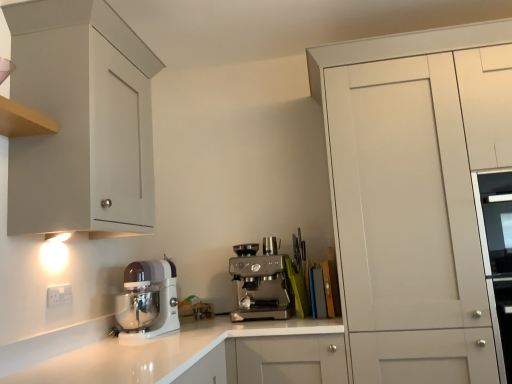
What do you see at coordinates (147, 300) in the screenshot? The height and width of the screenshot is (384, 512). I see `white glossy stand mixer at lower left, placed as the 2th kitchen appliance when sorted from right to left` at bounding box center [147, 300].

At what (x,y) coordinates should I click in order to perform the action: click on satin silver espresso machine at center, which ranks as the second kitchen appliance in left-to-right order. Please return your answer as a coordinate pair (x, y). Looking at the image, I should click on (261, 282).

Considering the sizes of white glossy countertop at center and white matte cabinet at right, the first cabinetry in the right-to-left sequence, in the image, is white glossy countertop at center wider or thinner than white matte cabinet at right, the first cabinetry in the right-to-left sequence,?

Considering their sizes, white glossy countertop at center looks slimmer than white matte cabinet at right, the first cabinetry in the right-to-left sequence.

From the image's perspective, which object appears higher, white glossy countertop at center or white matte cabinet at right, the second cabinetry from the left?

white matte cabinet at right, the second cabinetry from the left.

You are a GUI agent. You are given a task and a screenshot of the screen. Output one action in this format:
    pyautogui.click(x=<x>, y=<y>)
    Task: Click on the 1st cabinetry directly above the white glossy countertop at center (from a real-world perspective)
    
    Given the screenshot: What is the action you would take?
    pyautogui.click(x=415, y=195)

Looking at this image, considering the sizes of objects white glossy countertop at center and white matte cabinet at right, the second cabinetry from the left, in the image provided, who is smaller, white glossy countertop at center or white matte cabinet at right, the second cabinetry from the left,?

white glossy countertop at center is smaller.

Which of these two, white plastic electric outlet at lower left or white glossy countertop at center, stands taller?

white glossy countertop at center is taller.

Is white plastic electric outlet at lower left wider than white glossy countertop at center?

Incorrect, the width of white plastic electric outlet at lower left does not surpass that of white glossy countertop at center.

From a real-world perspective, is white plastic electric outlet at lower left positioned under white glossy countertop at center based on gravity?

Actually, white plastic electric outlet at lower left is physically above white glossy countertop at center in the real world.

Which point is more distant from viewer, (47, 291) or (115, 370)?

Point (47, 291)

Which of these two, white plastic electric outlet at lower left or satin silver espresso machine at center, marked as the 1th kitchen appliance in a right-to-left arrangement, is bigger?

satin silver espresso machine at center, marked as the 1th kitchen appliance in a right-to-left arrangement.

From a real-world perspective, who is located higher, white plastic electric outlet at lower left or satin silver espresso machine at center, which ranks as the second kitchen appliance in left-to-right order?

white plastic electric outlet at lower left, from a real-world perspective.

What's the angular difference between white plastic electric outlet at lower left and satin silver espresso machine at center, marked as the 1th kitchen appliance in a right-to-left arrangement,'s facing directions?

white plastic electric outlet at lower left and satin silver espresso machine at center, marked as the 1th kitchen appliance in a right-to-left arrangement, are facing 88.3 degrees away from each other.

Which object is more forward, matte gray cabinet at upper left, the 2th cabinetry when ordered from right to left, or satin silver espresso machine at center, marked as the 1th kitchen appliance in a right-to-left arrangement?

matte gray cabinet at upper left, the 2th cabinetry when ordered from right to left, is in front.

Are matte gray cabinet at upper left, the first cabinetry viewed from the left, and satin silver espresso machine at center, marked as the 1th kitchen appliance in a right-to-left arrangement, far apart?

No, there isn't a large distance between matte gray cabinet at upper left, the first cabinetry viewed from the left, and satin silver espresso machine at center, marked as the 1th kitchen appliance in a right-to-left arrangement.

How different are the orientations of matte gray cabinet at upper left, the 2th cabinetry when ordered from right to left, and satin silver espresso machine at center, marked as the 1th kitchen appliance in a right-to-left arrangement, in degrees?

They differ by 89.4 degrees in their facing directions.

Between matte gray cabinet at upper left, the 2th cabinetry when ordered from right to left, and satin silver espresso machine at center, which ranks as the second kitchen appliance in left-to-right order, which one has smaller size?

Smaller between the two is satin silver espresso machine at center, which ranks as the second kitchen appliance in left-to-right order.

Would you say white glossy stand mixer at lower left, which is counted as the first kitchen appliance, starting from the left, is part of white plastic electric outlet at lower left's contents?

No, white plastic electric outlet at lower left does not contain white glossy stand mixer at lower left, which is counted as the first kitchen appliance, starting from the left.

Is white plastic electric outlet at lower left further to the viewer compared to white glossy stand mixer at lower left, placed as the 2th kitchen appliance when sorted from right to left?

That is False.

In the scene shown: From a real-world perspective, is white plastic electric outlet at lower left under white glossy stand mixer at lower left, placed as the 2th kitchen appliance when sorted from right to left?

No.

This screenshot has width=512, height=384. I want to click on kitchen appliance that is the 1st one when counting backward from the white plastic electric outlet at lower left, so click(x=147, y=300).

Does white matte cabinet at right, the first cabinetry in the right-to-left sequence, have a larger size compared to satin silver espresso machine at center, marked as the 1th kitchen appliance in a right-to-left arrangement?

Yes, white matte cabinet at right, the first cabinetry in the right-to-left sequence, is bigger than satin silver espresso machine at center, marked as the 1th kitchen appliance in a right-to-left arrangement.

Considering the sizes of objects white matte cabinet at right, the first cabinetry in the right-to-left sequence, and satin silver espresso machine at center, which ranks as the second kitchen appliance in left-to-right order, in the image provided, who is wider, white matte cabinet at right, the first cabinetry in the right-to-left sequence, or satin silver espresso machine at center, which ranks as the second kitchen appliance in left-to-right order,?

white matte cabinet at right, the first cabinetry in the right-to-left sequence.

How many degrees apart are the facing directions of white matte cabinet at right, the first cabinetry in the right-to-left sequence, and satin silver espresso machine at center, which ranks as the second kitchen appliance in left-to-right order?

white matte cabinet at right, the first cabinetry in the right-to-left sequence, and satin silver espresso machine at center, which ranks as the second kitchen appliance in left-to-right order, are facing 0.39 degrees away from each other.

Does point (365, 91) appear closer or farther from the camera than point (256, 280)?

Point (365, 91).

At what (x,y) coordinates should I click in order to perform the action: click on cabinetry to the left of white matte cabinet at right, the first cabinetry in the right-to-left sequence. Please return your answer as a coordinate pair (x, y). Image resolution: width=512 pixels, height=384 pixels. Looking at the image, I should click on (81, 121).

Is white matte cabinet at right, the first cabinetry in the right-to-left sequence, far from matte gray cabinet at upper left, the first cabinetry viewed from the left?

Yes, white matte cabinet at right, the first cabinetry in the right-to-left sequence, is far from matte gray cabinet at upper left, the first cabinetry viewed from the left.

From the image's perspective, is white matte cabinet at right, the first cabinetry in the right-to-left sequence, beneath matte gray cabinet at upper left, the 2th cabinetry when ordered from right to left?

Indeed, from the image's perspective, white matte cabinet at right, the first cabinetry in the right-to-left sequence, is shown beneath matte gray cabinet at upper left, the 2th cabinetry when ordered from right to left.

Considering the relative sizes of white matte cabinet at right, the first cabinetry in the right-to-left sequence, and matte gray cabinet at upper left, the first cabinetry viewed from the left, in the image provided, is white matte cabinet at right, the first cabinetry in the right-to-left sequence, taller than matte gray cabinet at upper left, the first cabinetry viewed from the left,?

Yes, white matte cabinet at right, the first cabinetry in the right-to-left sequence, is taller than matte gray cabinet at upper left, the first cabinetry viewed from the left.

The height and width of the screenshot is (384, 512). Identify the location of cabinetry located on the right of white glossy countertop at center. click(415, 195).

Where is `electric outlet located in front of the white glossy countertop at center`? The height and width of the screenshot is (384, 512). electric outlet located in front of the white glossy countertop at center is located at coordinates (59, 295).

Looking at the image, which one is located further to satin silver espresso machine at center, which ranks as the second kitchen appliance in left-to-right order, white glossy countertop at center or white matte cabinet at right, the first cabinetry in the right-to-left sequence?

white matte cabinet at right, the first cabinetry in the right-to-left sequence, is positioned further to the anchor satin silver espresso machine at center, which ranks as the second kitchen appliance in left-to-right order.

Based on their spatial positions, is white glossy countertop at center or white matte cabinet at right, the first cabinetry in the right-to-left sequence, further from matte gray cabinet at upper left, the 2th cabinetry when ordered from right to left?

Among the two, white matte cabinet at right, the first cabinetry in the right-to-left sequence, is located further to matte gray cabinet at upper left, the 2th cabinetry when ordered from right to left.

Which object lies nearer to the anchor point white glossy stand mixer at lower left, which is counted as the first kitchen appliance, starting from the left, white plastic electric outlet at lower left or matte gray cabinet at upper left, the 2th cabinetry when ordered from right to left?

Among the two, white plastic electric outlet at lower left is located nearer to white glossy stand mixer at lower left, which is counted as the first kitchen appliance, starting from the left.

Based on their spatial positions, is matte gray cabinet at upper left, the 2th cabinetry when ordered from right to left, or white matte cabinet at right, the second cabinetry from the left, closer to white glossy stand mixer at lower left, which is counted as the first kitchen appliance, starting from the left?

matte gray cabinet at upper left, the 2th cabinetry when ordered from right to left, is positioned closer to the anchor white glossy stand mixer at lower left, which is counted as the first kitchen appliance, starting from the left.

Based on their spatial positions, is matte gray cabinet at upper left, the 2th cabinetry when ordered from right to left, or white glossy countertop at center further from white plastic electric outlet at lower left?

matte gray cabinet at upper left, the 2th cabinetry when ordered from right to left, lies further to white plastic electric outlet at lower left than the other object.

When comparing their distances from satin silver espresso machine at center, marked as the 1th kitchen appliance in a right-to-left arrangement, does white glossy stand mixer at lower left, which is counted as the first kitchen appliance, starting from the left, or white glossy countertop at center seem closer?

white glossy countertop at center is closer to satin silver espresso machine at center, marked as the 1th kitchen appliance in a right-to-left arrangement.

Based on the photo, when comparing their distances from white glossy stand mixer at lower left, placed as the 2th kitchen appliance when sorted from right to left, does satin silver espresso machine at center, marked as the 1th kitchen appliance in a right-to-left arrangement, or matte gray cabinet at upper left, the first cabinetry viewed from the left, seem closer?

Among the two, satin silver espresso machine at center, marked as the 1th kitchen appliance in a right-to-left arrangement, is located nearer to white glossy stand mixer at lower left, placed as the 2th kitchen appliance when sorted from right to left.

Looking at the image, which one is located closer to white glossy stand mixer at lower left, placed as the 2th kitchen appliance when sorted from right to left, white plastic electric outlet at lower left or white matte cabinet at right, the second cabinetry from the left?

white plastic electric outlet at lower left lies closer to white glossy stand mixer at lower left, placed as the 2th kitchen appliance when sorted from right to left, than the other object.

Image resolution: width=512 pixels, height=384 pixels. I want to click on cabinetry between white plastic electric outlet at lower left and satin silver espresso machine at center, marked as the 1th kitchen appliance in a right-to-left arrangement, in the horizontal direction, so click(81, 121).

Identify the location of electric outlet that lies between matte gray cabinet at upper left, the first cabinetry viewed from the left, and white glossy stand mixer at lower left, placed as the 2th kitchen appliance when sorted from right to left, from top to bottom. The height and width of the screenshot is (384, 512). (59, 295).

Where is `cabinetry located between white plastic electric outlet at lower left and white matte cabinet at right, the second cabinetry from the left, in the left-right direction`? The image size is (512, 384). cabinetry located between white plastic electric outlet at lower left and white matte cabinet at right, the second cabinetry from the left, in the left-right direction is located at coordinates (81, 121).

Identify the location of electric outlet between matte gray cabinet at upper left, the 2th cabinetry when ordered from right to left, and white glossy countertop at center vertically. This screenshot has width=512, height=384. (59, 295).